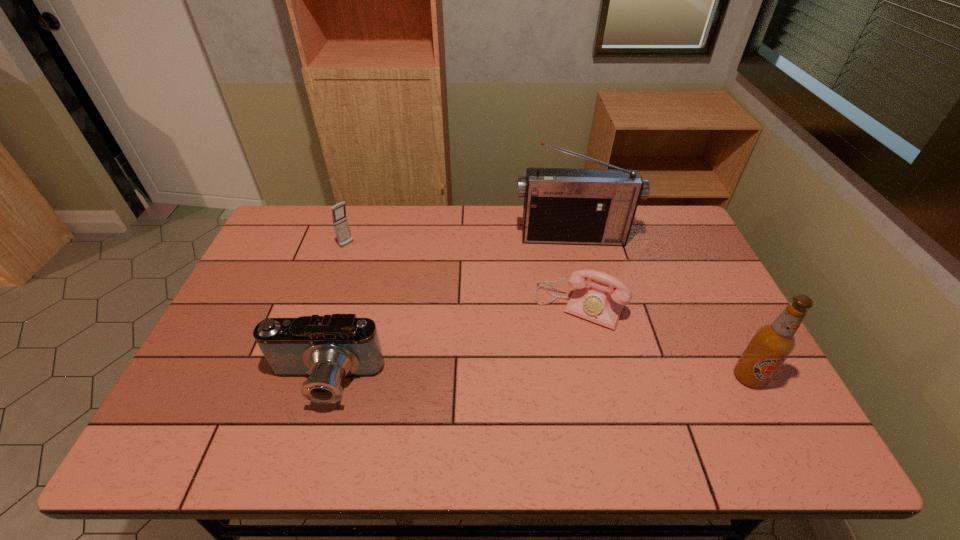
Locate an element on the screen. The height and width of the screenshot is (540, 960). camcorder is located at coordinates (326, 349).

Where is `the fourth shortest object`? This screenshot has width=960, height=540. the fourth shortest object is located at coordinates (772, 344).

Where is `the rightmost object`? This screenshot has height=540, width=960. the rightmost object is located at coordinates (772, 344).

Identify the location of radio receiver. This screenshot has width=960, height=540. (571, 206).

Where is `cellular telephone`? cellular telephone is located at coordinates (340, 222).

Locate an element on the screen. This screenshot has width=960, height=540. the third farthest object is located at coordinates (595, 304).

At what (x,y) coordinates should I click in order to perform the action: click on telephone. Please return your answer as a coordinate pair (x, y). The width and height of the screenshot is (960, 540). Looking at the image, I should click on click(595, 304).

At what (x,y) coordinates should I click in order to perform the action: click on free point located on the front-facing side of the tallest object. Please return your answer as a coordinate pair (x, y). This screenshot has height=540, width=960. Looking at the image, I should click on (583, 313).

This screenshot has height=540, width=960. I want to click on blank area located 0.050m on the front-facing side of the tallest object, so click(573, 256).

At what (x,y) coordinates should I click in order to perform the action: click on vacant space located 0.180m on the front-facing side of the tallest object. Please return your answer as a coordinate pair (x, y). The width and height of the screenshot is (960, 540). Looking at the image, I should click on (578, 285).